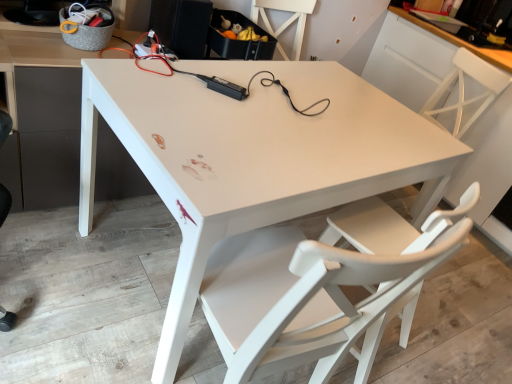
The height and width of the screenshot is (384, 512). What do you see at coordinates (369, 227) in the screenshot?
I see `white matte chair at upper right, which is the 1th chair in right-to-left order` at bounding box center [369, 227].

At what (x,y) coordinates should I click in order to perform the action: click on white glossy table at center. Please return your answer as a coordinate pair (x, y). Image resolution: width=512 pixels, height=384 pixels. Looking at the image, I should click on (253, 155).

Locate an element on the screen. The width and height of the screenshot is (512, 384). white matte chair at upper right, marked as the 1th chair in a back-to-front arrangement is located at coordinates [x=369, y=227].

Is white glossy table at center shorter than white matte chair at lower right, the 1th chair when ordered from front to back?

Yes.

Is white glossy table at center not close to white matte chair at lower right, the 2th chair viewed from the right?

white glossy table at center is actually quite close to white matte chair at lower right, the 2th chair viewed from the right.

Consider the image. Measure the distance from white glossy table at center to white matte chair at lower right, the 2th chair viewed from the right.

white glossy table at center and white matte chair at lower right, the 2th chair viewed from the right, are 13.37 inches apart.

Which is more to the right, white glossy table at center or white matte chair at upper right, marked as the 2th chair in a left-to-right arrangement?

white matte chair at upper right, marked as the 2th chair in a left-to-right arrangement.

Looking at this image, from a real-world perspective, who is located lower, white glossy table at center or white matte chair at upper right, marked as the 1th chair in a back-to-front arrangement?

white glossy table at center, from a real-world perspective.

Considering the sizes of white glossy table at center and white matte chair at upper right, marked as the 2th chair in a left-to-right arrangement, in the image, is white glossy table at center bigger or smaller than white matte chair at upper right, marked as the 2th chair in a left-to-right arrangement,?

white glossy table at center is smaller than white matte chair at upper right, marked as the 2th chair in a left-to-right arrangement.

Is point (203, 201) positioned in front of point (431, 102)?

Yes, point (203, 201) is in front of point (431, 102).

From the image's perspective, between white matte chair at lower right, the 2th chair viewed from the right, and white glossy table at center, which one is located above?

white glossy table at center is shown above in the image.

Is white matte chair at lower right, which is the first chair in left-to-right order, further to the viewer compared to white glossy table at center?

Yes, it is.

In terms of height, does white matte chair at lower right, the 2th chair viewed from the right, look taller or shorter compared to white glossy table at center?

white matte chair at lower right, the 2th chair viewed from the right, is taller than white glossy table at center.

Is white matte chair at upper right, the 2th chair when ordered from front to back, behind white matte chair at lower right, the 1th chair when ordered from front to back?

That is True.

Considering the relative sizes of white matte chair at upper right, which is the 1th chair in right-to-left order, and white matte chair at lower right, which ranks as the second chair in back-to-front order, in the image provided, is white matte chair at upper right, which is the 1th chair in right-to-left order, wider than white matte chair at lower right, which ranks as the second chair in back-to-front order,?

Yes.

You are a GUI agent. You are given a task and a screenshot of the screen. Output one action in this format:
    pyautogui.click(x=<x>, y=<y>)
    Task: Click on the chair that is behind the white matte chair at lower right, the 1th chair when ordered from front to back
    The height and width of the screenshot is (384, 512).
    Given the screenshot: What is the action you would take?
    pyautogui.click(x=369, y=227)

Is white matte chair at upper right, the 2th chair when ordered from front to back, not inside white matte chair at lower right, the 1th chair when ordered from front to back?

white matte chair at upper right, the 2th chair when ordered from front to back, is positioned outside white matte chair at lower right, the 1th chair when ordered from front to back.

Which point is more forward, [457,122] or [300,96]?

Positioned in front is point [300,96].

Could white glossy table at center be considered to be inside white matte chair at upper right, which is the 1th chair in right-to-left order?

No, white matte chair at upper right, which is the 1th chair in right-to-left order, does not contain white glossy table at center.

Is white matte chair at upper right, marked as the 2th chair in a left-to-right arrangement, to the left of white glossy table at center from the viewer's perspective?

Incorrect, white matte chair at upper right, marked as the 2th chair in a left-to-right arrangement, is not on the left side of white glossy table at center.

At what (x,y) coordinates should I click in order to perform the action: click on table that is in front of the white matte chair at upper right, which is the 1th chair in right-to-left order. Please return your answer as a coordinate pair (x, y). This screenshot has width=512, height=384. Looking at the image, I should click on (253, 155).

There is a white matte chair at lower right, the 1th chair when ordered from front to back. What are the coordinates of `chair above it (from a real-world perspective)` in the screenshot? It's located at (369, 227).

Can you confirm if white matte chair at lower right, which is the first chair in left-to-right order, is shorter than white matte chair at upper right, which is the 1th chair in right-to-left order?

Indeed, white matte chair at lower right, which is the first chair in left-to-right order, has a lesser height compared to white matte chair at upper right, which is the 1th chair in right-to-left order.

Does white matte chair at lower right, the 1th chair when ordered from front to back, appear on the right side of white matte chair at upper right, marked as the 1th chair in a back-to-front arrangement?

No, white matte chair at lower right, the 1th chair when ordered from front to back, is not to the right of white matte chair at upper right, marked as the 1th chair in a back-to-front arrangement.

Considering the sizes of white matte chair at lower right, the 1th chair when ordered from front to back, and white matte chair at upper right, the 2th chair when ordered from front to back, in the image, is white matte chair at lower right, the 1th chair when ordered from front to back, wider or thinner than white matte chair at upper right, the 2th chair when ordered from front to back,?

Clearly, white matte chair at lower right, the 1th chair when ordered from front to back, has less width compared to white matte chair at upper right, the 2th chair when ordered from front to back.

Where is `table above the white matte chair at lower right, the 2th chair viewed from the right (from the image's perspective)`? table above the white matte chair at lower right, the 2th chair viewed from the right (from the image's perspective) is located at coordinates (253, 155).

Where is `chair that is the 2nd object located behind the white glossy table at center`? chair that is the 2nd object located behind the white glossy table at center is located at coordinates (369, 227).

Looking at the image, which one is located closer to white glossy table at center, white matte chair at upper right, marked as the 1th chair in a back-to-front arrangement, or white matte chair at lower right, the 1th chair when ordered from front to back?

white matte chair at lower right, the 1th chair when ordered from front to back, is closer to white glossy table at center.

Which object lies nearer to the anchor point white glossy table at center, white matte chair at lower right, the 2th chair viewed from the right, or white matte chair at upper right, marked as the 1th chair in a back-to-front arrangement?

white matte chair at lower right, the 2th chair viewed from the right.

Consider the image. Looking at the image, which one is located closer to white matte chair at upper right, marked as the 2th chair in a left-to-right arrangement, white matte chair at lower right, the 1th chair when ordered from front to back, or white glossy table at center?

The object closer to white matte chair at upper right, marked as the 2th chair in a left-to-right arrangement, is white glossy table at center.

Considering their positions, is white glossy table at center positioned further to white matte chair at lower right, which ranks as the second chair in back-to-front order, than white matte chair at upper right, which is the 1th chair in right-to-left order?

Among the two, white matte chair at upper right, which is the 1th chair in right-to-left order, is located further to white matte chair at lower right, which ranks as the second chair in back-to-front order.

When comparing their distances from white matte chair at lower right, which ranks as the second chair in back-to-front order, does white matte chair at upper right, marked as the 2th chair in a left-to-right arrangement, or white glossy table at center seem closer?

white glossy table at center lies closer to white matte chair at lower right, which ranks as the second chair in back-to-front order, than the other object.

Based on their spatial positions, is white glossy table at center or white matte chair at lower right, the 1th chair when ordered from front to back, further from white matte chair at upper right, marked as the 1th chair in a back-to-front arrangement?

The object further to white matte chair at upper right, marked as the 1th chair in a back-to-front arrangement, is white matte chair at lower right, the 1th chair when ordered from front to back.

I want to click on chair between white glossy table at center and white matte chair at upper right, marked as the 2th chair in a left-to-right arrangement, so click(x=318, y=294).